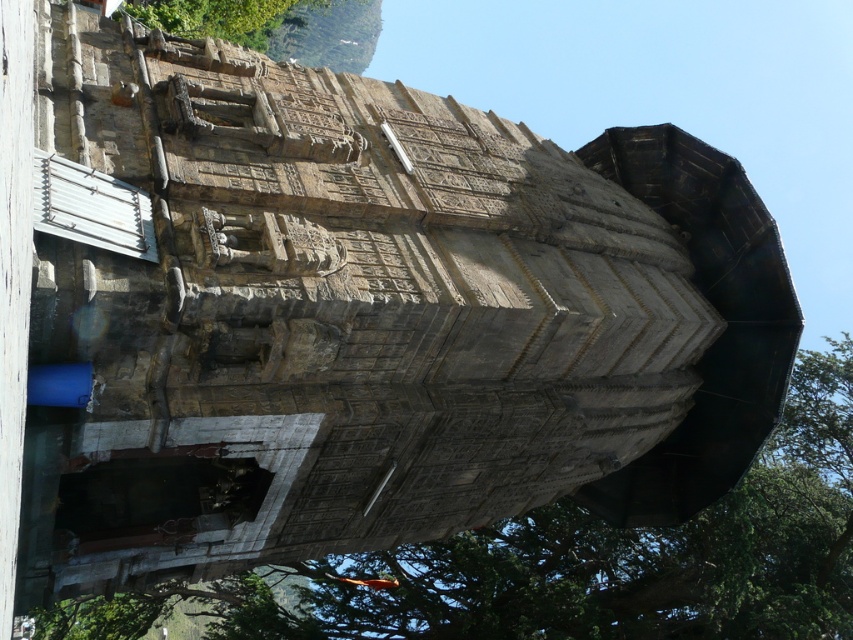
You are standing at the point marked by the coordinates point (573, 561) in the ancient stone structure scene. What object are you facing? Please refer to the scene description for context.

The point (573, 561) corresponds to the green leafy tree at lower left, so you are facing the green leafy tree at lower left.

You are standing in front of the ancient stone structure and want to take a photo that includes both the green leafy tree at lower left and the green leafy tree at upper center. Which tree should you position to your left to capture both in the frame?

To capture both the green leafy tree at lower left and the green leafy tree at upper center in the frame, position the green leafy tree at upper center to your left since the green leafy tree at lower left is to the right of it.